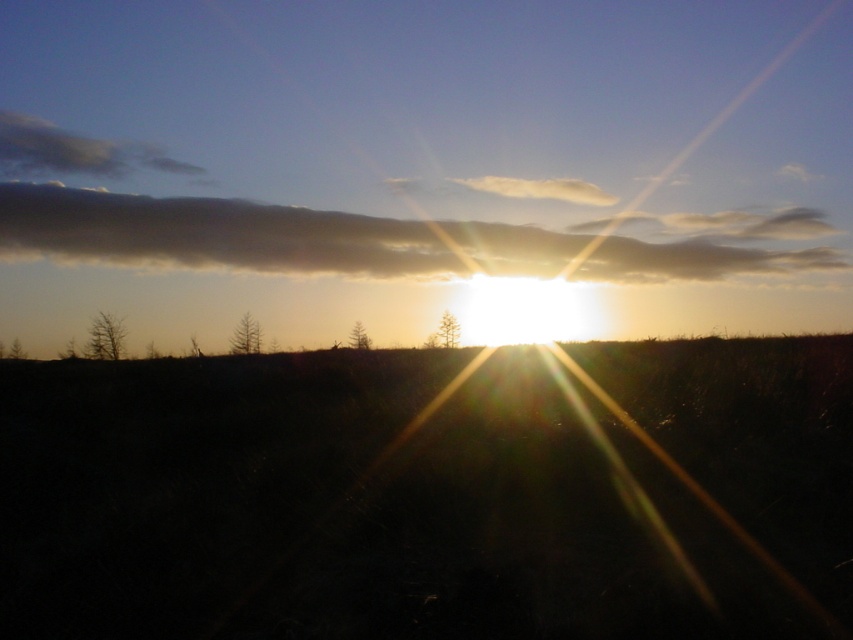
Is dark gray cloud at upper center further to the viewer compared to white fluffy cloud at upper left?

No, dark gray cloud at upper center is in front of white fluffy cloud at upper left.

At what (x,y) coordinates should I click in order to perform the action: click on dark gray cloud at upper center. Please return your answer as a coordinate pair (x, y). Looking at the image, I should click on (372, 240).

Is point (228, 253) farther from camera compared to point (480, 188)?

No.

Is dark gray cloud at upper center below white fluffy cloud at upper center?

Indeed, dark gray cloud at upper center is positioned under white fluffy cloud at upper center.

Is point (341, 234) in front of point (592, 189)?

Yes.

This screenshot has width=853, height=640. Identify the location of dark gray cloud at upper center. (372, 240).

Identify the location of white fluffy cloud at upper left. The height and width of the screenshot is (640, 853). (73, 150).

Which is in front, point (18, 154) or point (389, 179)?

Point (389, 179)

Is point (4, 112) behind point (490, 184)?

That is True.

This screenshot has height=640, width=853. Identify the location of white fluffy cloud at upper left. (73, 150).